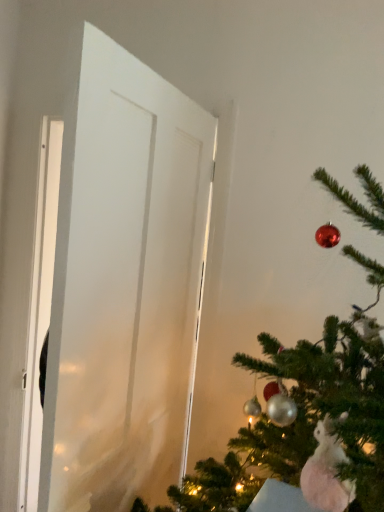
What do you see at coordinates (127, 287) in the screenshot? I see `frosted glass door at center` at bounding box center [127, 287].

The width and height of the screenshot is (384, 512). Identify the location of frosted glass door at center. (127, 287).

In order to face frosted glass door at center, should I rotate leftwards or rightwards?

A 6.852 degree turn to the left will do.

The width and height of the screenshot is (384, 512). I want to click on frosted glass door at center, so click(x=127, y=287).